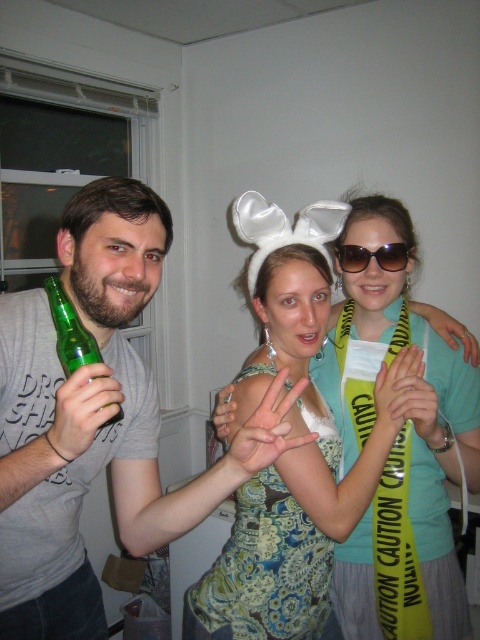
Question: Does floral dress at center appear under green glass bottle at left?

Choices:
 (A) yes
 (B) no

Answer: (A)

Question: Which of the following is the closest to the observer?

Choices:
 (A) (275, 422)
 (B) (52, 276)
 (C) (372, 323)
 (D) (395, 260)

Answer: (A)

Question: Which of the following is the farthest from the observer?

Choices:
 (A) sunglasses at center
 (B) gray cotton t-shirt at left
 (C) green glass bottle at left
 (D) floral dress at center

Answer: (A)

Question: Can you confirm if gray cotton t-shirt at left is positioned above sunglasses at center?

Choices:
 (A) no
 (B) yes

Answer: (A)

Question: Is the position of gray cotton t-shirt at left more distant than that of green glass bottle at left?

Choices:
 (A) no
 (B) yes

Answer: (A)

Question: Which object appears closest to the camera in this image?

Choices:
 (A) floral dress at center
 (B) green glass bottle at left
 (C) sunglasses at center
 (D) gray cotton t-shirt at left

Answer: (D)